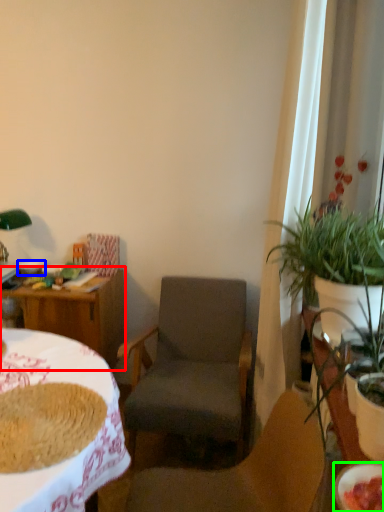
Question: Which object is the closest to the table (highlighted by a red box)? Choose among these: bowl (highlighted by a blue box) or bowl (highlighted by a green box).

Choices:
 (A) bowl
 (B) bowl

Answer: (A)